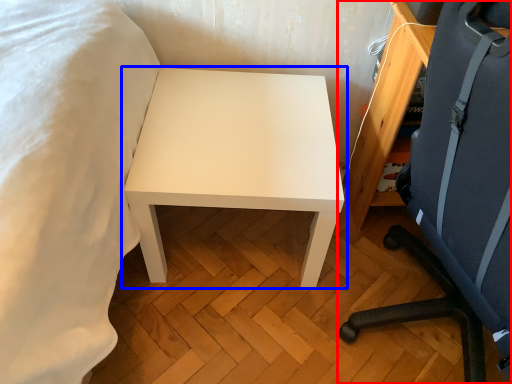
Question: Which of the following is the farthest to the observer, chair (highlighted by a red box) or table (highlighted by a blue box)?

Choices:
 (A) chair
 (B) table

Answer: (B)